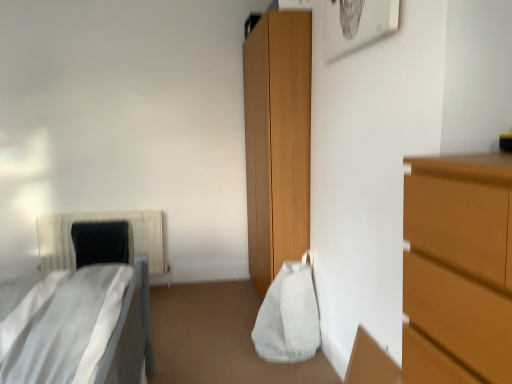
Question: In the image, is white fabric bag at center positioned in front of or behind white fabric bed at left?

Choices:
 (A) front
 (B) behind

Answer: (B)

Question: Based on their positions, is white fabric bag at center located to the left or right of white fabric bed at left?

Choices:
 (A) right
 (B) left

Answer: (A)

Question: Based on their relative distances, which object is nearer to the white textured radiator at left?

Choices:
 (A) white fabric bed at left
 (B) black fabric pillow at left
 (C) white fabric bag at center

Answer: (B)

Question: Which is nearer to the white fabric bed at left?

Choices:
 (A) white textured radiator at left
 (B) white fabric bag at center
 (C) black fabric pillow at left

Answer: (B)